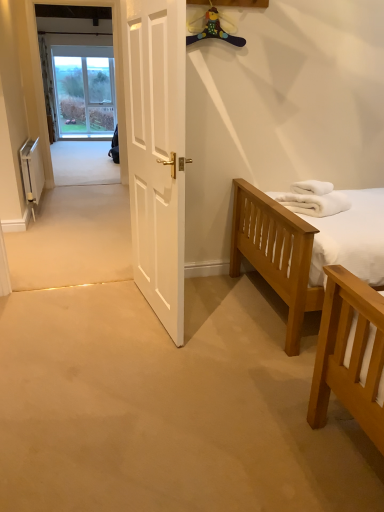
Question: From the image's perspective, is white fluffy towels at right on white matte door at center?

Choices:
 (A) no
 (B) yes

Answer: (A)

Question: Can you confirm if white fluffy towels at right is wider than white matte door at center?

Choices:
 (A) yes
 (B) no

Answer: (A)

Question: Is white fluffy towels at right thinner than white matte door at center?

Choices:
 (A) yes
 (B) no

Answer: (B)

Question: Does white fluffy towels at right have a smaller size compared to white matte door at center?

Choices:
 (A) yes
 (B) no

Answer: (A)

Question: Is white fluffy towels at right further to camera compared to white matte door at center?

Choices:
 (A) yes
 (B) no

Answer: (A)

Question: From the image's perspective, is white fluffy towels at right below white matte door at center?

Choices:
 (A) no
 (B) yes

Answer: (B)

Question: Would you say white metallic radiator at left is a long distance from white fluffy towels at right?

Choices:
 (A) no
 (B) yes

Answer: (B)

Question: Considering the relative sizes of white metallic radiator at left and white fluffy towels at right in the image provided, is white metallic radiator at left taller than white fluffy towels at right?

Choices:
 (A) no
 (B) yes

Answer: (B)

Question: From a real-world perspective, is white metallic radiator at left under white fluffy towels at right?

Choices:
 (A) no
 (B) yes

Answer: (B)

Question: Is white metallic radiator at left positioned behind white fluffy towels at right?

Choices:
 (A) no
 (B) yes

Answer: (B)

Question: Is white metallic radiator at left turned away from white fluffy towels at right?

Choices:
 (A) yes
 (B) no

Answer: (B)

Question: Is white metallic radiator at left next to white fluffy towels at right?

Choices:
 (A) yes
 (B) no

Answer: (B)

Question: Is white matte door at center bigger than white metallic radiator at left?

Choices:
 (A) yes
 (B) no

Answer: (A)